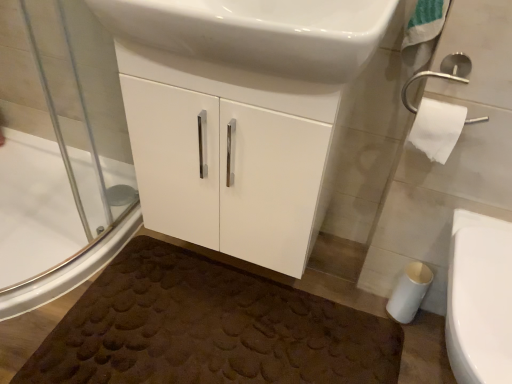
Where is `vacant location below transparent glass shower door at left (from a real-world perspective)`? Image resolution: width=512 pixels, height=384 pixels. vacant location below transparent glass shower door at left (from a real-world perspective) is located at coordinates (80, 251).